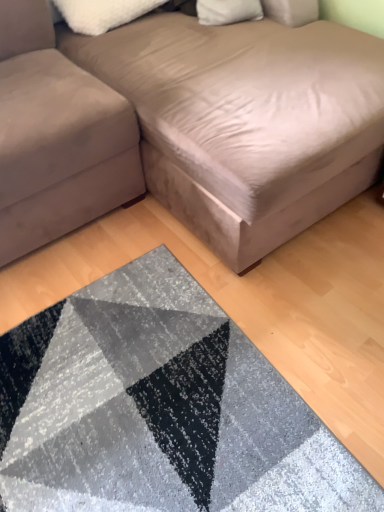
Question: Is textured gray rug at lower center to the left or to the right of white fluffy pillow at upper center in the image?

Choices:
 (A) right
 (B) left

Answer: (A)

Question: Considering the positions of textured gray rug at lower center and white fluffy pillow at upper center in the image, is textured gray rug at lower center bigger or smaller than white fluffy pillow at upper center?

Choices:
 (A) small
 (B) big

Answer: (B)

Question: Which object is the closest to the suede-like beige studio couch at upper center, marked as the first studio couch in a right-to-left arrangement?

Choices:
 (A) white fluffy pillow at upper center
 (B) suede-like beige couch at lower left, which is the 1th studio couch in left-to-right order
 (C) textured gray rug at lower center

Answer: (B)

Question: Considering the real-world distances, which object is farthest from the white fluffy pillow at upper center?

Choices:
 (A) suede-like beige studio couch at upper center, marked as the first studio couch in a right-to-left arrangement
 (B) suede-like beige couch at lower left, marked as the 2th studio couch in a right-to-left arrangement
 (C) textured gray rug at lower center

Answer: (C)